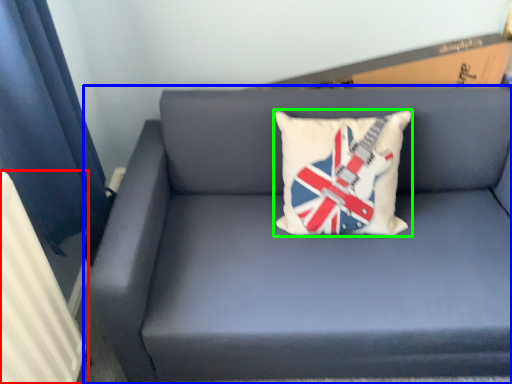
Question: Which object is positioned farthest from radiator (highlighted by a red box)? Select from studio couch (highlighted by a blue box) and pillow (highlighted by a green box).

Choices:
 (A) studio couch
 (B) pillow

Answer: (B)